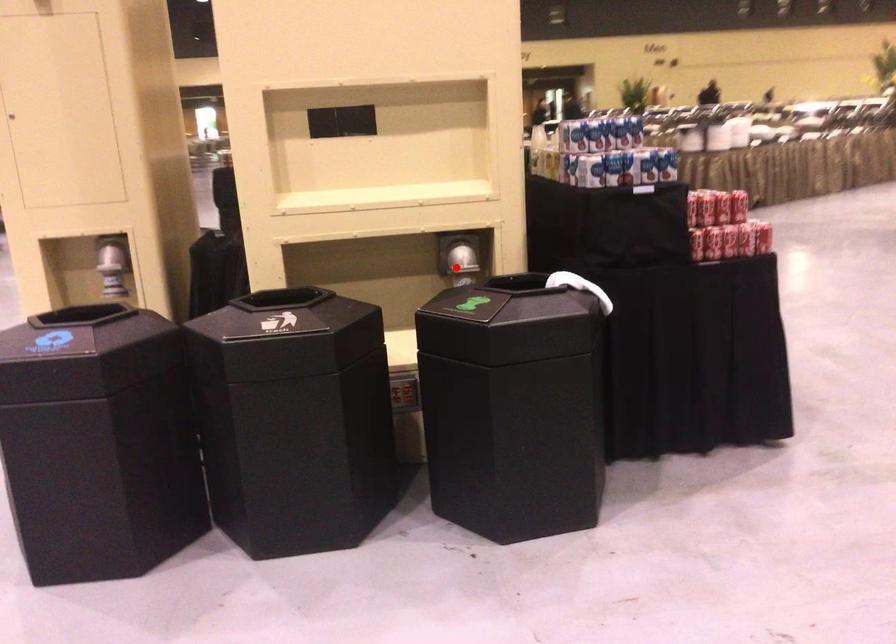
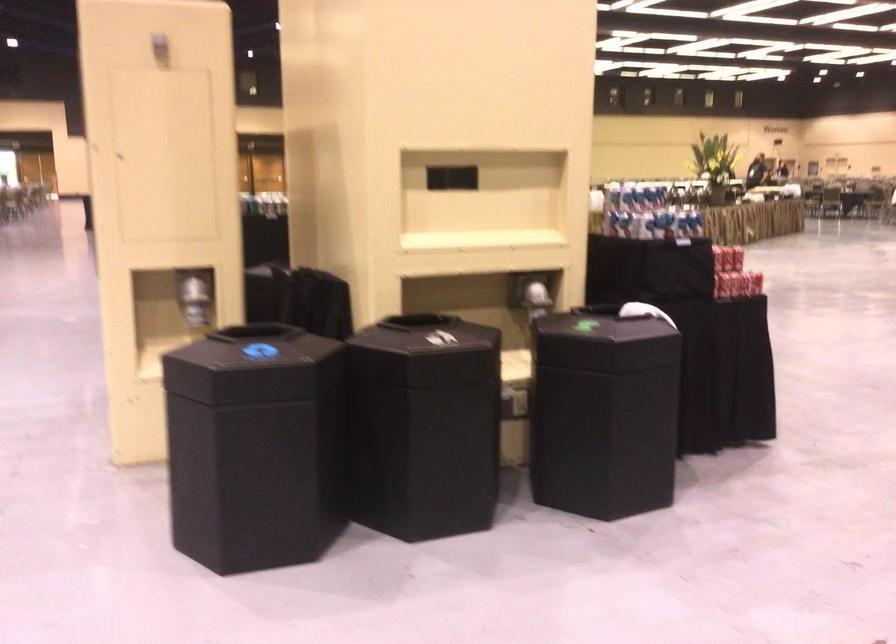
Question: A red point is marked in image1. In image2, is the corresponding 3D point closer to the camera or farther? Reply with the corresponding letter.

Choices:
 (A) The corresponding 3D point is closer.
 (B) The corresponding 3D point is farther.

Answer: (B)